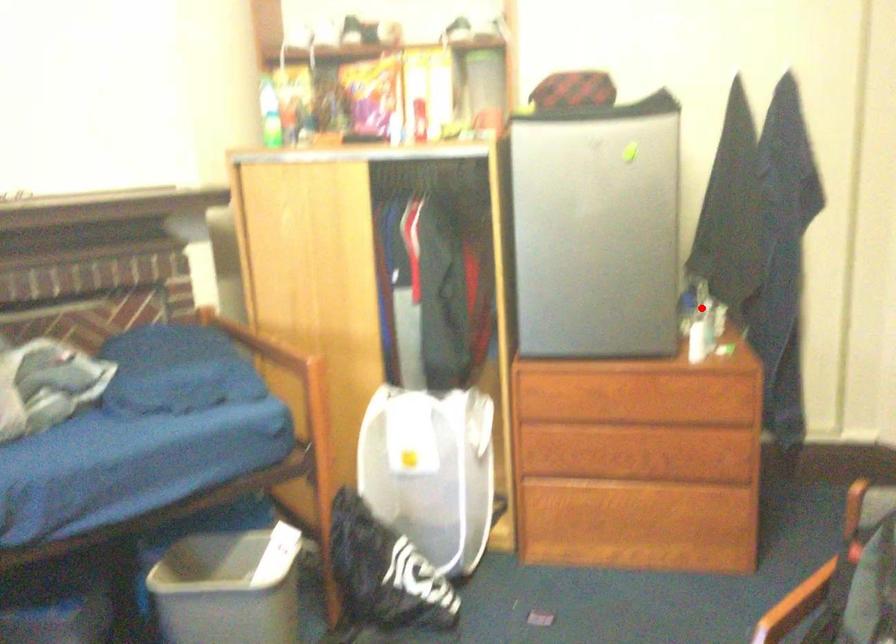
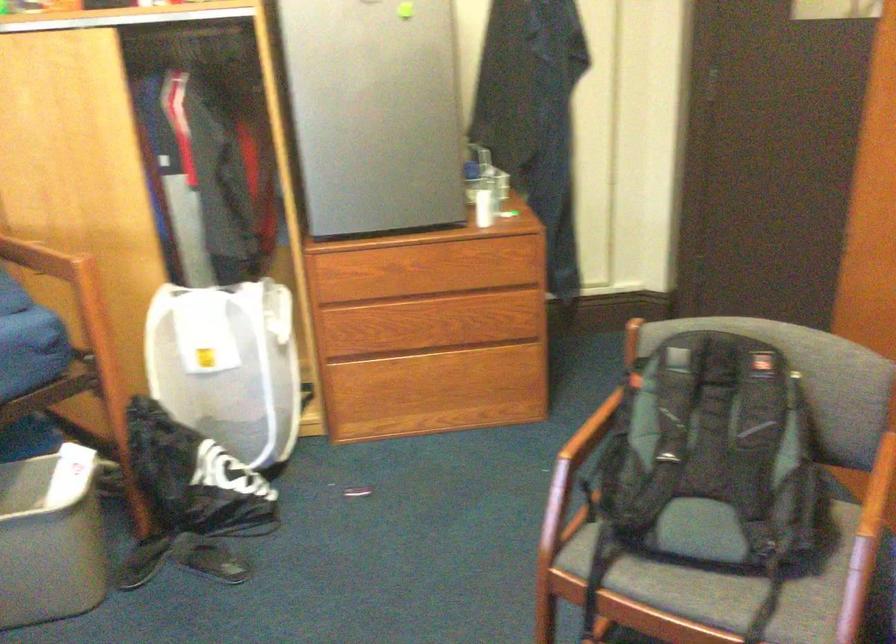
Where in the second image is the point corresponding to the highlighted location from the first image?

(485, 178)